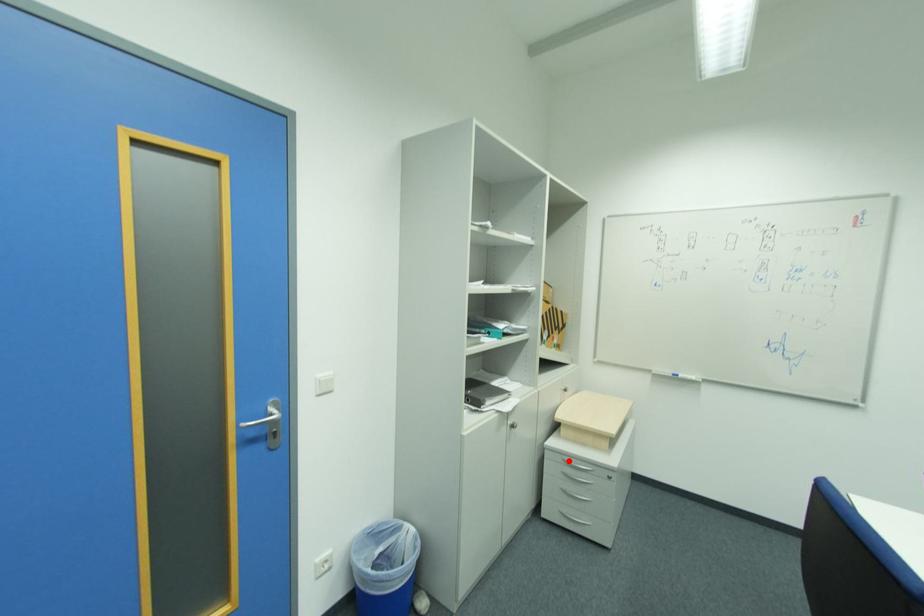
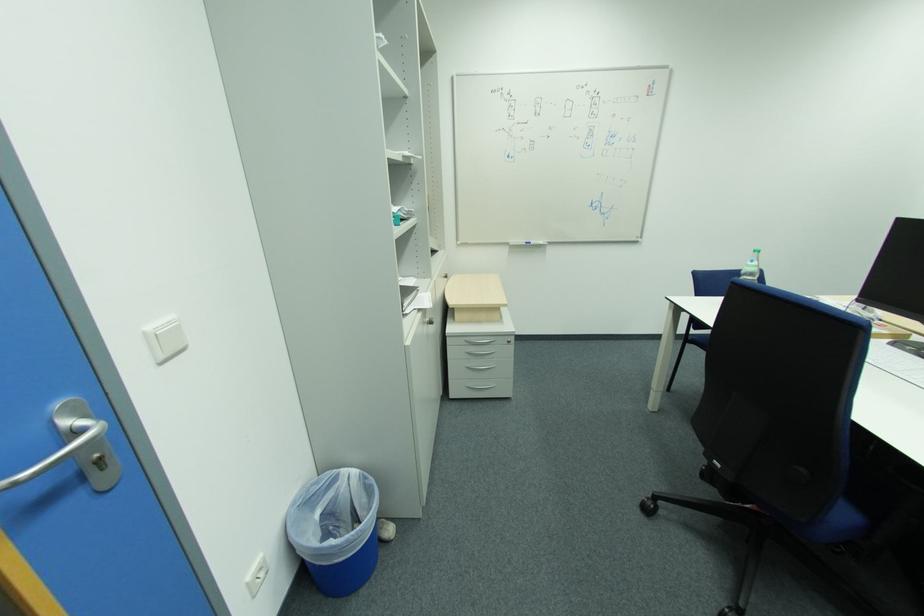
The point at the highlighted location is marked in the first image. Where is the corresponding point in the second image?

(471, 342)